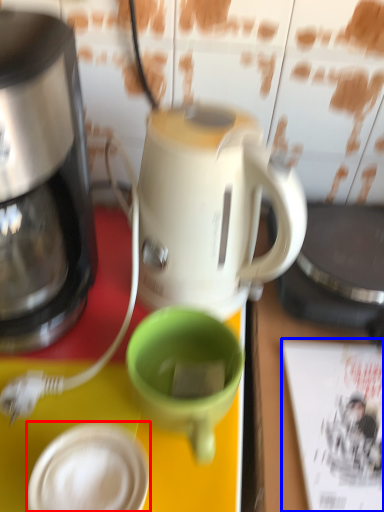
Question: Among these objects, which one is farthest to the camera, tableware (highlighted by a red box) or magazine (highlighted by a blue box)?

Choices:
 (A) tableware
 (B) magazine

Answer: (B)